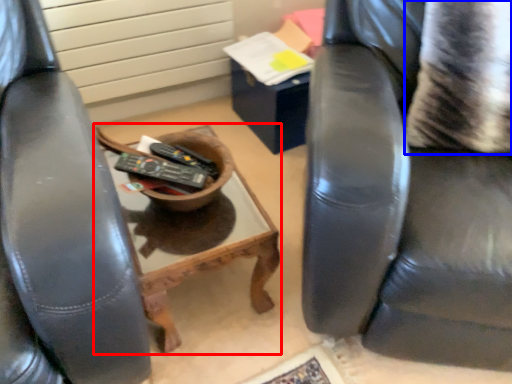
Question: Which point is closer to the camera, table (highlighted by a red box) or pillow (highlighted by a blue box)?

Choices:
 (A) table
 (B) pillow

Answer: (B)